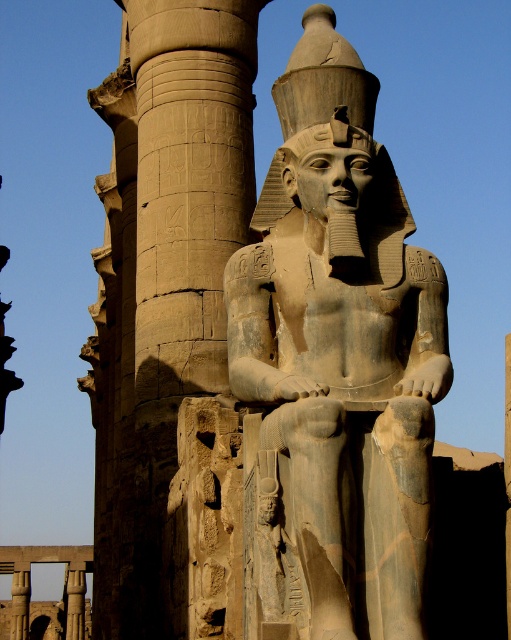
You are an archaeologist examining an ancient Egyptian temple site. You notice the gray stone statue at center and the sandstone column at center. Which object is smaller in size?

The gray stone statue at center is smaller in size compared to the sandstone column at center.

You are an archaeologist examining the ancient Egyptian statue. You notice two points marked on the statue. The first point is at coordinates point (x=261, y=193) and the second is at point (x=261, y=8). From your vantage point, which of these two points is nearer to you?

Point (x=261, y=193) is closer to the viewer than point (x=261, y=8).

You are an archaeologist examining the ancient Egyptian statue. You notice a specific point at coordinates (335, 365). What object is located at that point?

The gray stone statue at center is located at point (335, 365).